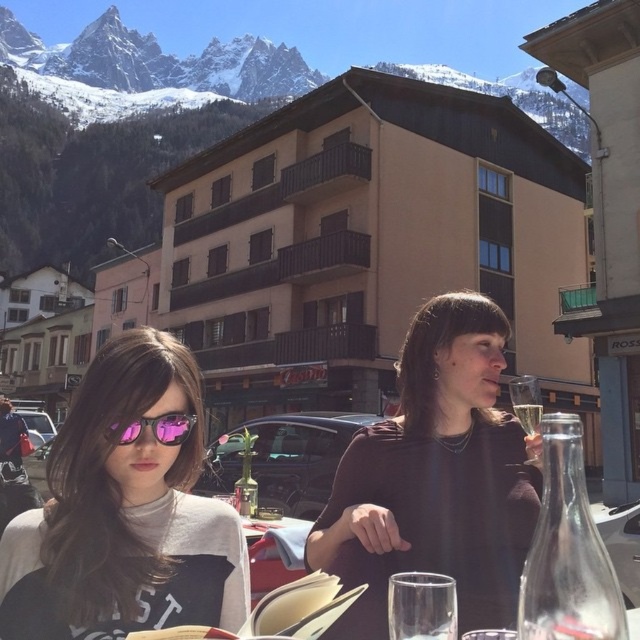
Does beige wood hotel at center have a lesser width compared to clear glass wine at upper right?

No.

Can you confirm if beige wood hotel at center is wider than clear glass wine at upper right?

Yes.

Describe the element at coordinates (364, 240) in the screenshot. The height and width of the screenshot is (640, 640). I see `beige wood hotel at center` at that location.

The width and height of the screenshot is (640, 640). Identify the location of beige wood hotel at center. (364, 240).

Is transparent glass at lower center positioned in front of pink reflective sunglasses at center?

Yes, it is in front of pink reflective sunglasses at center.

Measure the distance between transparent glass at lower center and camera.

A distance of 21.50 meters exists between transparent glass at lower center and camera.

Locate an element on the screen. transparent glass at lower center is located at coordinates (420, 605).

How far apart are matte black dress at center and snowy rock mountain at upper left?

The distance of matte black dress at center from snowy rock mountain at upper left is 351.39 meters.

Which of these two, matte black dress at center or snowy rock mountain at upper left, stands shorter?

Standing shorter between the two is matte black dress at center.

At what (x,y) coordinates should I click in order to perform the action: click on matte black dress at center. Please return your answer as a coordinate pair (x, y). This screenshot has width=640, height=640. Looking at the image, I should click on (435, 477).

Image resolution: width=640 pixels, height=640 pixels. Find the location of `matte black dress at center`. matte black dress at center is located at coordinates click(x=435, y=477).